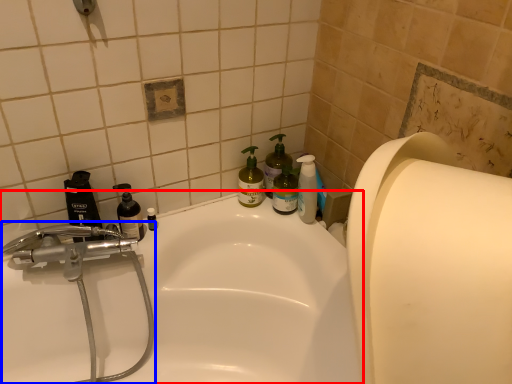
Question: Which point is further to the camera, bathtub (highlighted by a red box) or plumbing fixture (highlighted by a blue box)?

Choices:
 (A) bathtub
 (B) plumbing fixture

Answer: (B)